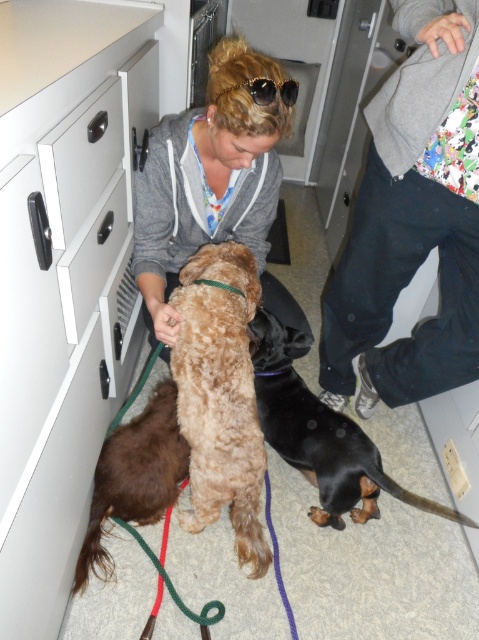
You are a service robot in a veterinary clinic. You need to move a medical kit from the white plastic drawer at left to the brown fuzzy dog at lower left. The robot has an arm that can reach 20 inches. Can you safely deliver the medical kit without moving either the dog or the drawer?

The distance between the brown fuzzy dog at lower left and the white plastic drawer at left is 19.71 inches. Since the robot arm can reach 20 inches, it can safely deliver the medical kit without needing to move either object.

You are a visitor entering the veterinary clinic and need to locate the white plastic file cabinet at left. From your perspective, where would you find it in relation to the matte gray hoodie at center?

The white plastic file cabinet at left is positioned under the matte gray hoodie at center, so it would be located directly below the matte gray hoodie at center from your viewpoint.

You are organizing medical supplies in a veterinary clinic. You have a large box of bandages that needs to be stored. Which drawer should you choose between the white matte drawer at center left and the white plastic drawer at left to ensure the box fits properly?

The white matte drawer at center left has a larger width than the white plastic drawer at left, so you should choose the white matte drawer at center left to store the large box of bandages as it can accommodate the item better.